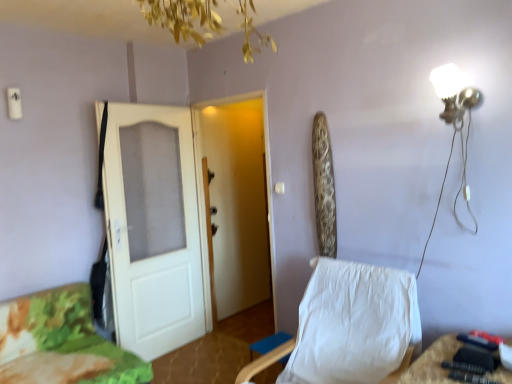
Question: Does white matte door at left, arranged as the 2th door when viewed from the right, appear on the right side of white fabric chair at center?

Choices:
 (A) yes
 (B) no

Answer: (B)

Question: Is white matte door at left, arranged as the 2th door when viewed from the right, to the left of white fabric chair at center from the viewer's perspective?

Choices:
 (A) no
 (B) yes

Answer: (B)

Question: Is white matte door at left, which appears as the 1th door when viewed from the left, facing away from white fabric chair at center?

Choices:
 (A) yes
 (B) no

Answer: (B)

Question: From a real-world perspective, is white matte door at left, which appears as the 1th door when viewed from the left, beneath white fabric chair at center?

Choices:
 (A) no
 (B) yes

Answer: (A)

Question: Is white matte door at left, arranged as the 2th door when viewed from the right, thinner than white fabric chair at center?

Choices:
 (A) no
 (B) yes

Answer: (B)

Question: In terms of height, does white glossy wall lamp at upper right look taller or shorter compared to white fabric chair at center?

Choices:
 (A) short
 (B) tall

Answer: (A)

Question: From the image's perspective, is white glossy wall lamp at upper right positioned above or below white fabric chair at center?

Choices:
 (A) below
 (B) above

Answer: (B)

Question: Is white glossy wall lamp at upper right wider or thinner than white fabric chair at center?

Choices:
 (A) thin
 (B) wide

Answer: (A)

Question: Choose the correct answer: Is white glossy wall lamp at upper right inside white fabric chair at center or outside it?

Choices:
 (A) inside
 (B) outside

Answer: (B)

Question: Considering the positions of point (259, 291) and point (435, 91), is point (259, 291) closer or farther from the camera than point (435, 91)?

Choices:
 (A) closer
 (B) farther

Answer: (B)

Question: From a real-world perspective, relative to white glossy wall lamp at upper right, is white matte door at left, arranged as the 2th door when viewed from the right, vertically above or below?

Choices:
 (A) above
 (B) below

Answer: (B)

Question: Considering the positions of white matte door at left, arranged as the 2th door when viewed from the right, and white glossy wall lamp at upper right in the image, is white matte door at left, arranged as the 2th door when viewed from the right, wider or thinner than white glossy wall lamp at upper right?

Choices:
 (A) thin
 (B) wide

Answer: (A)

Question: In terms of size, does white matte door at left, arranged as the 2th door when viewed from the right, appear bigger or smaller than white glossy wall lamp at upper right?

Choices:
 (A) small
 (B) big

Answer: (B)

Question: Do you think white glossy wall lamp at upper right is within camouflage fabric bed at lower left, or outside of it?

Choices:
 (A) outside
 (B) inside

Answer: (A)

Question: From their relative heights in the image, would you say white glossy wall lamp at upper right is taller or shorter than camouflage fabric bed at lower left?

Choices:
 (A) tall
 (B) short

Answer: (A)